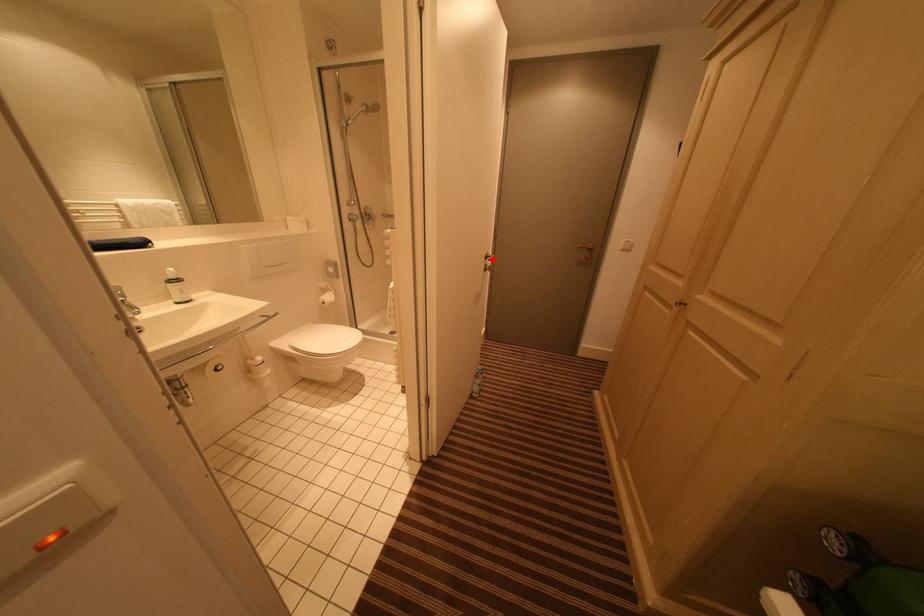
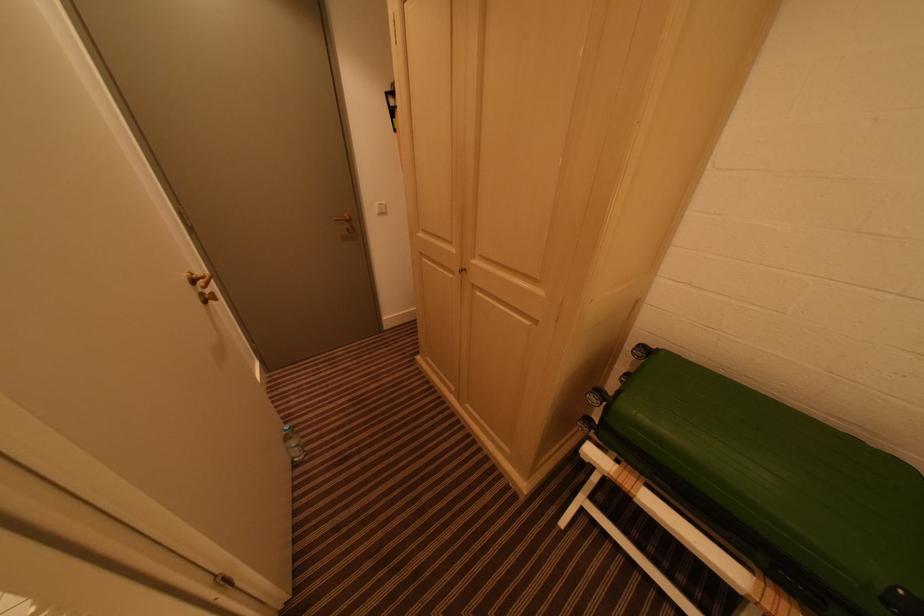
Where in the second image is the point corresponding to the highlighted location from the first image?

(200, 284)